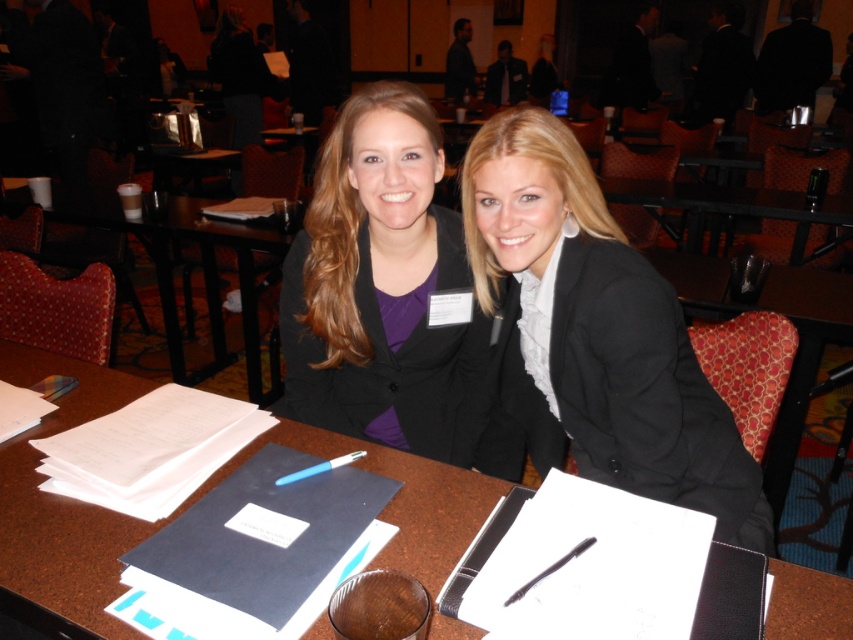
Question: In this image, where is matte black blazer at center located relative to brown wooden table at center?

Choices:
 (A) below
 (B) above

Answer: (A)

Question: Which point appears farthest from the camera in this image?

Choices:
 (A) (315, 467)
 (B) (213, 308)
 (C) (173, 513)

Answer: (B)

Question: Can you confirm if black matte blazer at center is smaller than brown wooden table at center?

Choices:
 (A) no
 (B) yes

Answer: (B)

Question: Which object is the farthest from the brown wood table at center?

Choices:
 (A) matte black blazer at center
 (B) black matte blazer at center

Answer: (B)

Question: Can you confirm if brown wood table at center is bigger than brown wooden table at center?

Choices:
 (A) yes
 (B) no

Answer: (B)

Question: Which object is the closest to the black matte blazer at center?

Choices:
 (A) blue plastic pen at center
 (B) brown wood table at center
 (C) brown wooden table at center

Answer: (B)